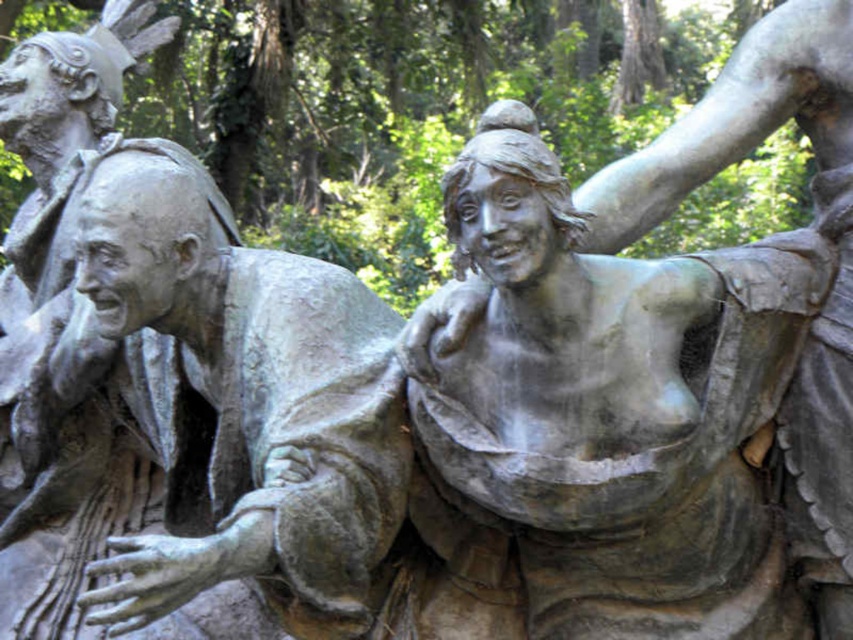
Question: Can you confirm if bronze statue at center is smaller than bronze statue at left?

Choices:
 (A) yes
 (B) no

Answer: (A)

Question: Can you confirm if bronze statue at center is bigger than bronze statue at left?

Choices:
 (A) no
 (B) yes

Answer: (A)

Question: Can you confirm if bronze statue at center is positioned above bronze statue at left?

Choices:
 (A) no
 (B) yes

Answer: (B)

Question: Which object appears farthest from the camera in this image?

Choices:
 (A) bronze statue at left
 (B) bronze statue at center

Answer: (B)